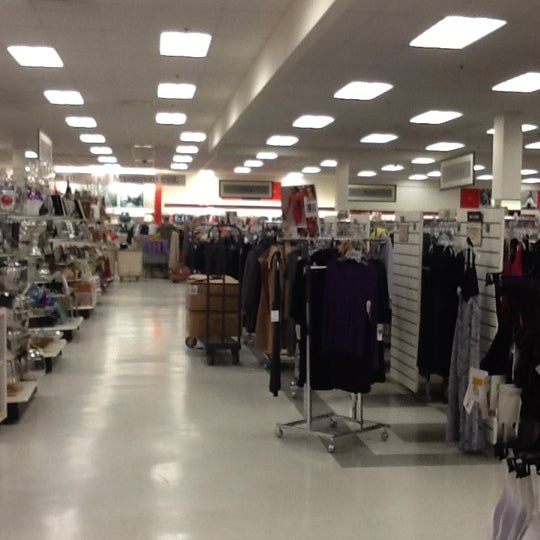
This screenshot has height=540, width=540. In order to click on metal rack with wheels in this screenshot , I will do (307, 431).